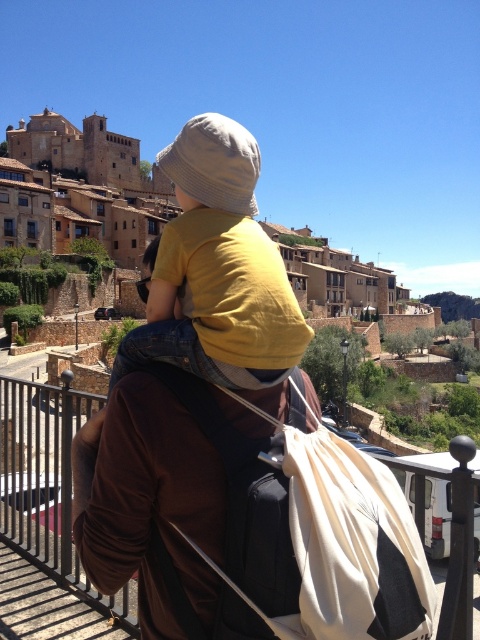
You are a photographer trying to capture the matte yellow shirt at center in your shot. The camera you are using has a rectangular viewfinder with a fixed aspect ratio of 4x6. You want to frame the scene so that the point marked by point (216, 269) is exactly at the center of your viewfinder. Given the coordinates of the point, can you determine if the matte yellow shirt at center will be fully visible within the viewfinder?

The point marked by point (216, 269) is exactly at the center of the viewfinder, so the matte yellow shirt at center will be fully visible within the viewfinder as long as the viewfinder is positioned to include that central area.

You are standing at the viewpoint and want to take a photo of the matte yellow shirt at center and the metallic gray railing at center. Which object should you focus on first if you want to capture both in the frame without moving the camera?

The matte yellow shirt at center is to the right of the metallic gray railing at center. Since the shirt is positioned to the right, you should focus on the metallic gray railing at center first to ensure both are in the frame without moving the camera.